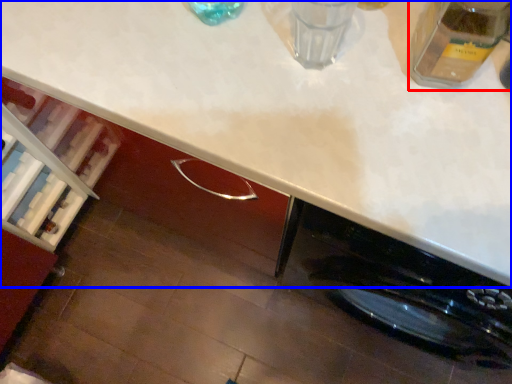
Question: Which point is further to the camera, glass jar (highlighted by a red box) or countertop (highlighted by a blue box)?

Choices:
 (A) glass jar
 (B) countertop

Answer: (A)